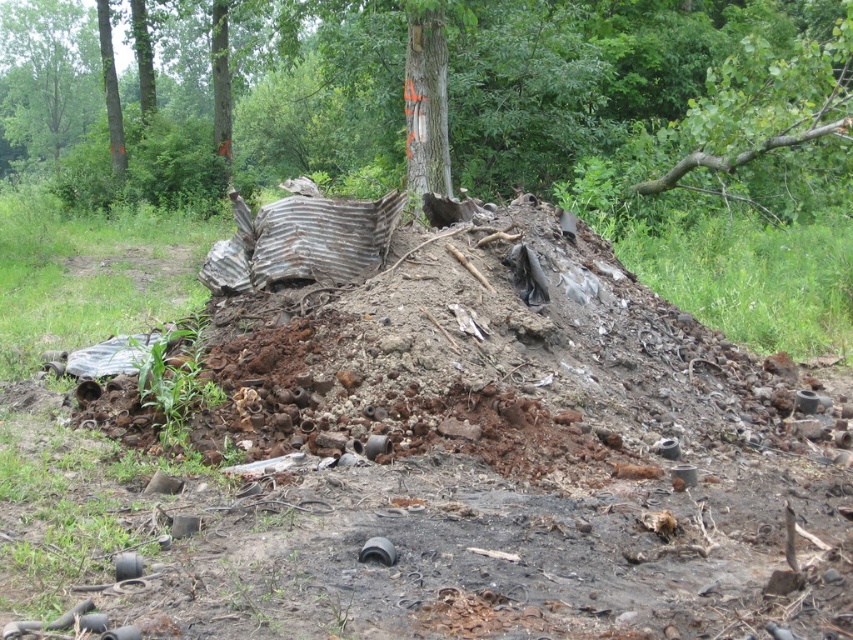
Question: Does smooth bark tree at center come behind smooth brown tree trunk at center?

Choices:
 (A) yes
 (B) no

Answer: (B)

Question: Where is smooth bark tree at center located in relation to smooth brown tree trunk at center in the image?

Choices:
 (A) below
 (B) above

Answer: (B)

Question: Is smooth bark tree at center thinner than smooth brown tree trunk at center?

Choices:
 (A) no
 (B) yes

Answer: (A)

Question: Which point is farther to the camera?

Choices:
 (A) smooth brown tree trunk at center
 (B) smooth bark tree at center

Answer: (A)